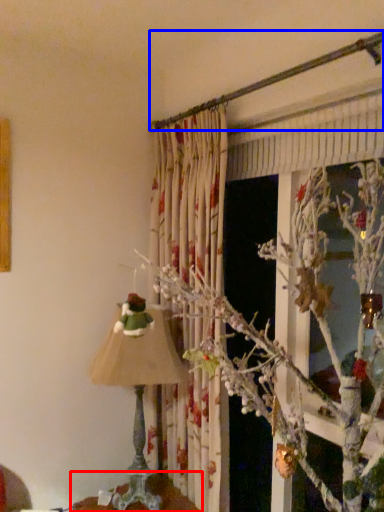
Question: Which object is closer to the camera taking this photo, furniture (highlighted by a red box) or branch (highlighted by a blue box)?

Choices:
 (A) furniture
 (B) branch

Answer: (B)